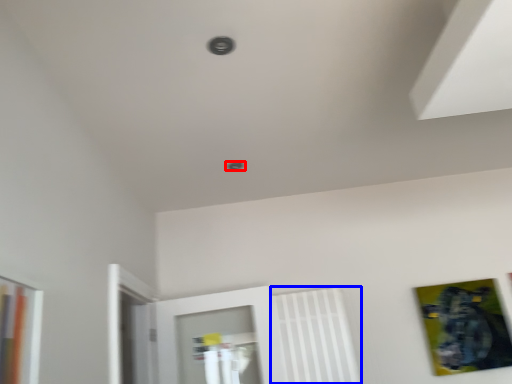
Question: Which of the following is the closest to the observer, hole (highlighted by a red box) or radiator (highlighted by a blue box)?

Choices:
 (A) hole
 (B) radiator

Answer: (A)